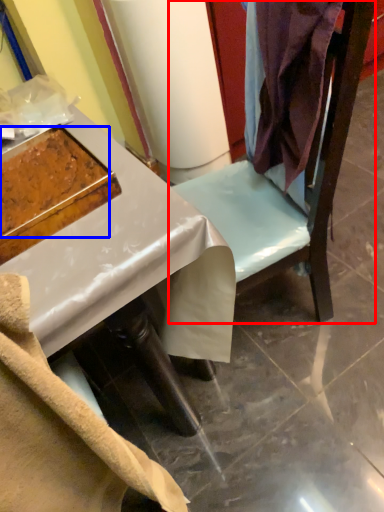
Question: Which object appears farthest to the camera in this image, furniture (highlighted by a red box) or food (highlighted by a blue box)?

Choices:
 (A) furniture
 (B) food

Answer: (B)